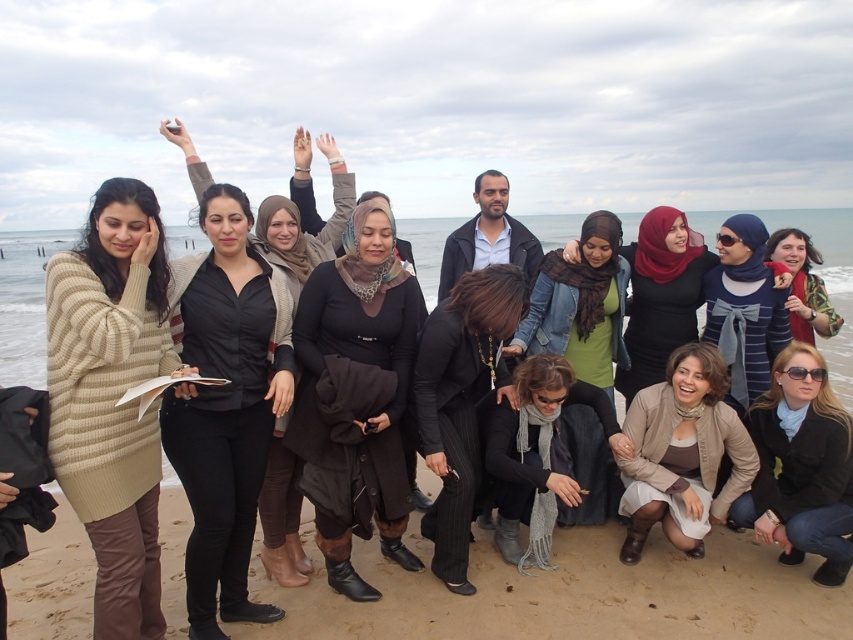
You are standing at the beach and want to hand a towel to someone wearing the black matte coat at center and the light beige sweater at lower right. Which person should you approach first if you want to give the towel to the person closer to you?

You should give the towel to the black matte coat at center first because it is closer to the viewer than the light beige sweater at lower right.

Consider the image. You are a photographer trying to capture a candid shot of the group. You notice the black matte coat at center and the light beige sweater at lower right. Which of these two items is positioned closer to the left side of the frame?

The black matte coat at center is positioned to the left of the light beige sweater at lower right, so it is closer to the left side of the frame.

You are a photographer trying to capture a clear shot of the red scarf at right and the blue striped sweater at center. Which object will appear smaller in your photo?

The red scarf at right appears smaller because it is positioned behind the blue striped sweater at center, making it farther from the camera.